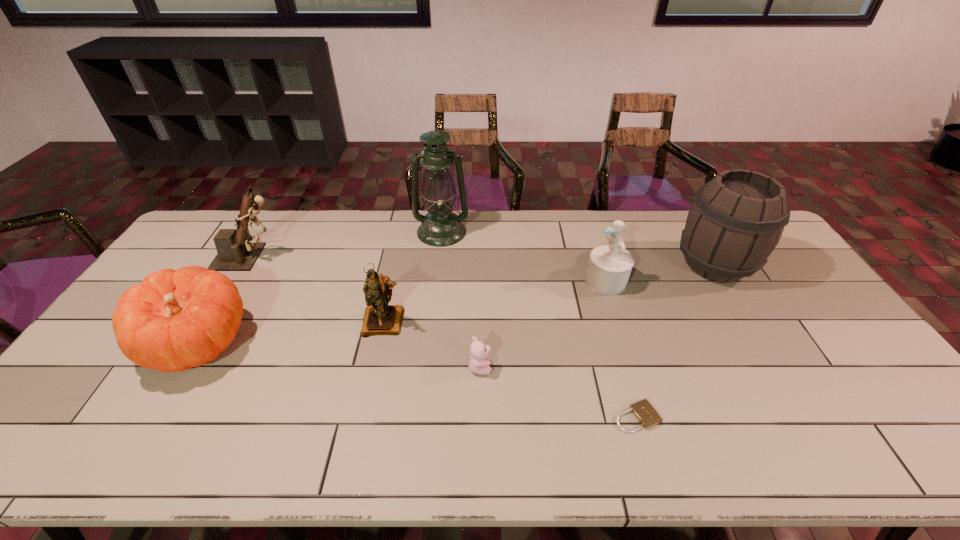
Identify which object is located as the third nearest to the pumpkin. Please provide its 2D coordinates. Your answer should be formatted as a tuple, i.e. [(x, y)], where the tuple contains the x and y coordinates of a point satisfying the conditions above.

[(441, 227)]

Select which object is the closest to the rightmost figurine. Please provide its 2D coordinates. Your answer should be formatted as a tuple, i.e. [(x, y)], where the tuple contains the x and y coordinates of a point satisfying the conditions above.

[(736, 220)]

At what (x,y) coordinates should I click in order to perform the action: click on figurine that is the third closest one to the rightmost object. Please return your answer as a coordinate pair (x, y). The image size is (960, 540). Looking at the image, I should click on (237, 251).

This screenshot has width=960, height=540. In order to click on the closest figurine relative to the padlock in this screenshot , I will do `click(609, 266)`.

Locate an element on the screen. Image resolution: width=960 pixels, height=540 pixels. vacant space that satisfies the following two spatial constraints: 1. at the beak of the rightmost figurine; 2. on the front-facing side of the second figurine from left to right is located at coordinates (619, 322).

The image size is (960, 540). Find the location of `blank space that satisfies the following two spatial constraints: 1. on the front-facing side of the second figurine from right to left; 2. on the left side of the padlock`. blank space that satisfies the following two spatial constraints: 1. on the front-facing side of the second figurine from right to left; 2. on the left side of the padlock is located at coordinates (364, 417).